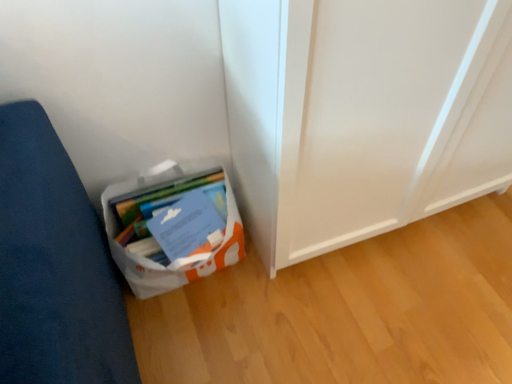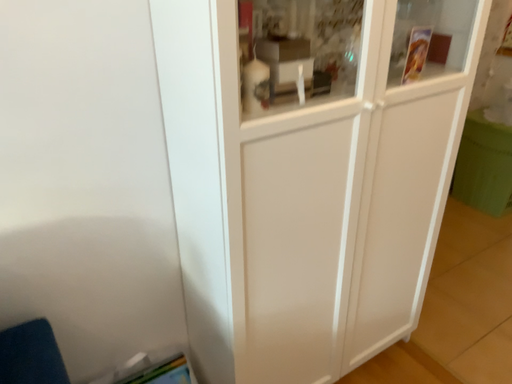
Question: How did the camera likely rotate when shooting the video?

Choices:
 (A) rotated left
 (B) rotated right

Answer: (B)